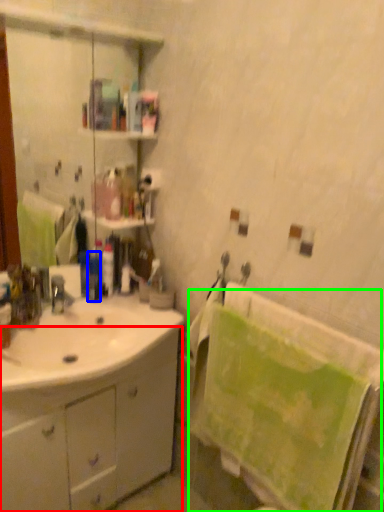
Question: Which object is positioned farthest from bathroom cabinet (highlighted by a red box)? Select from toiletry (highlighted by a blue box) and bath towel (highlighted by a green box).

Choices:
 (A) toiletry
 (B) bath towel

Answer: (A)